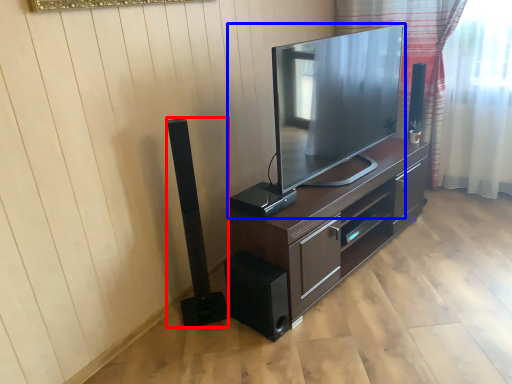
Question: Which object is closer to the camera taking this photo, speaker (highlighted by a red box) or television (highlighted by a blue box)?

Choices:
 (A) speaker
 (B) television

Answer: (B)